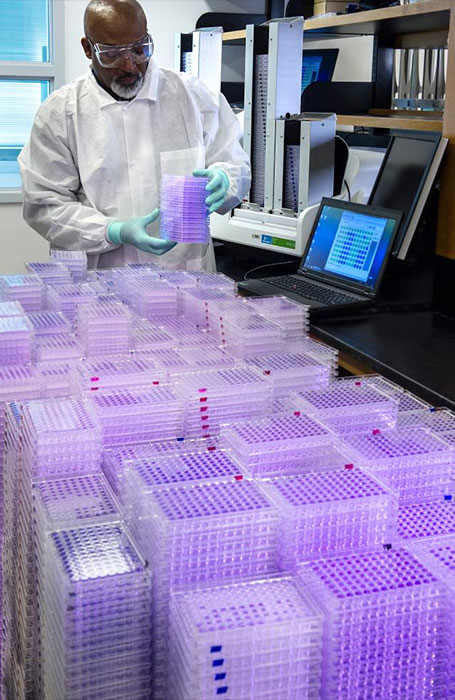
Locate an element on the screen. desk is located at coordinates (395, 335).